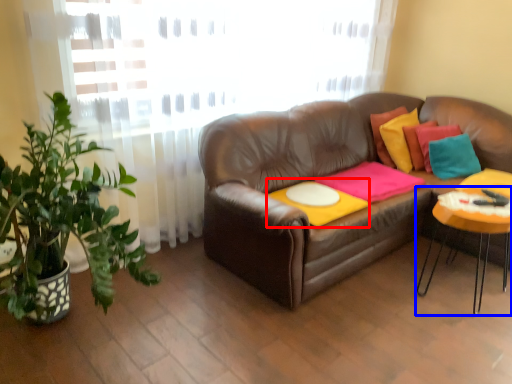
Question: Which object appears closest to the camera in this image, round table (highlighted by a red box) or table (highlighted by a blue box)?

Choices:
 (A) round table
 (B) table

Answer: (B)